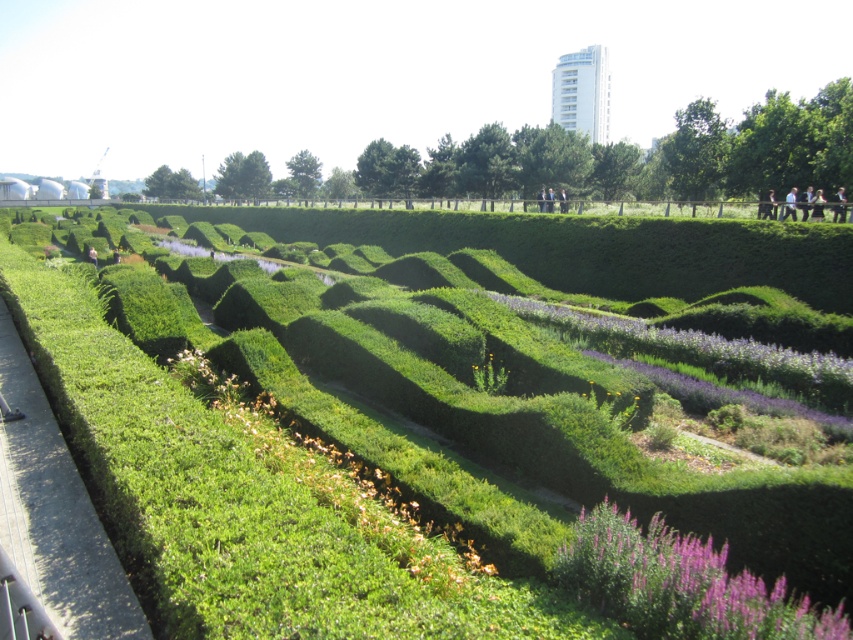
You are a gardener planning to plant a new row of flowers between the green grassy hedge at center and the light blue shirt at upper right. Which area has more space available for planting?

The light blue shirt at upper right has more space available because the green grassy hedge at center occupies less space than it.

You are standing in the garden and see the green hedge maze at center and the light blue shirt at upper right. Which object is positioned to the left when viewed from your perspective?

The green hedge maze at center is to the left of the light blue shirt at upper right.

You are standing in the garden and want to take a photo. You notice two points in the scene labeled as point (184, 381) and point (790, 198). Which point should you focus on to ensure it appears larger in your photo?

Point (184, 381) is closer to the camera than point (790, 198), so focusing on point (184, 381) will make it appear larger in the photo.